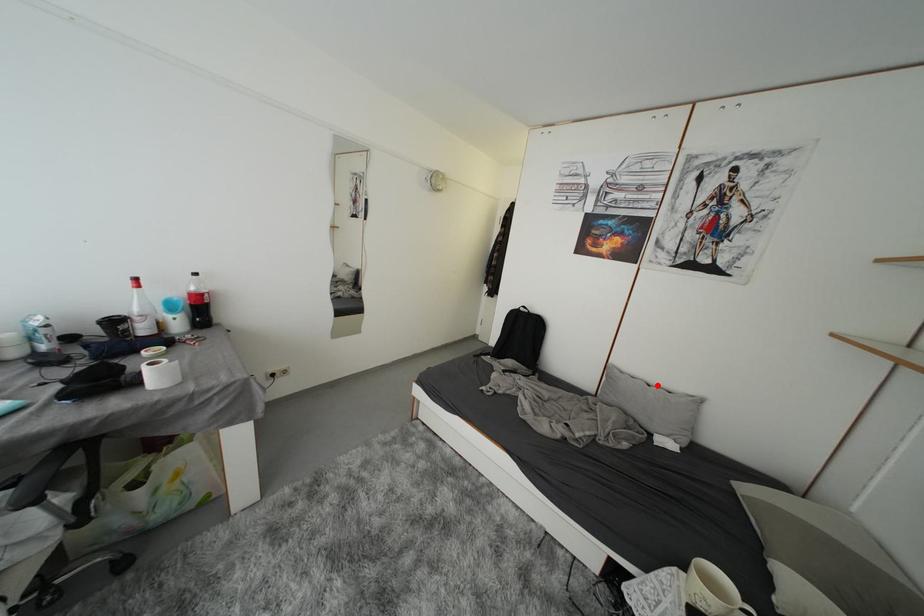
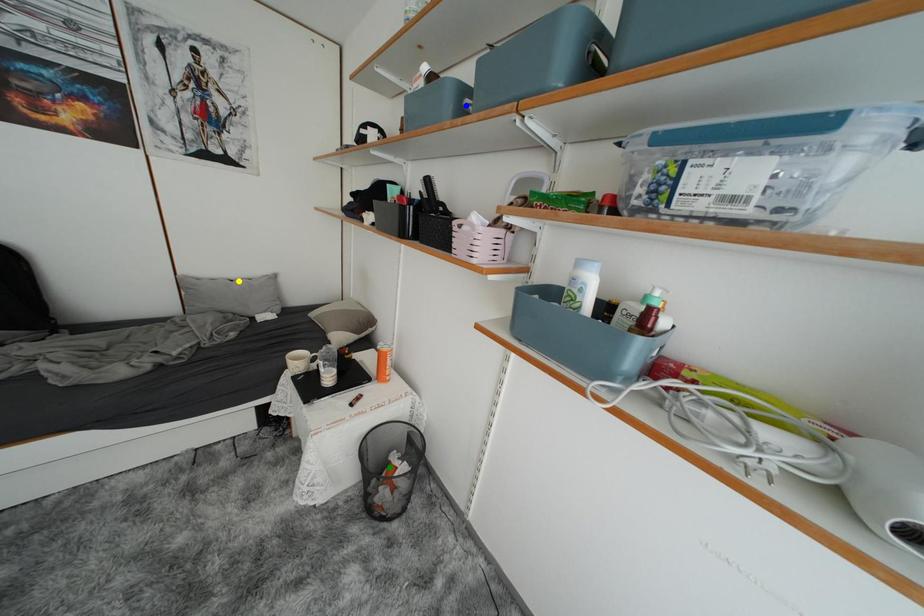
Question: I am providing you with two images of the same scene from different viewpoints. A red point is marked on the first image. You are given multiple points on the second image. Which point in image 2 represents the same 3d spot as the red point in image 1?

Choices:
 (A) green point
 (B) yellow point
 (C) blue point

Answer: (B)